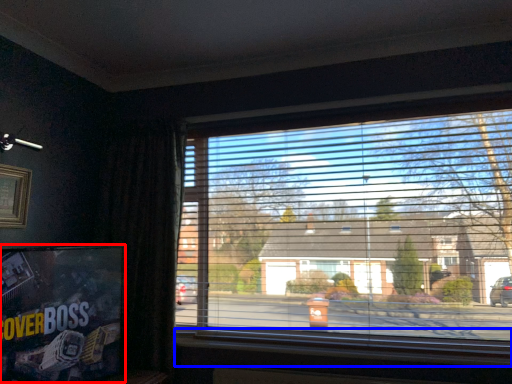
Question: Which point is further to the camera, tv show (highlighted by a red box) or window sill (highlighted by a blue box)?

Choices:
 (A) tv show
 (B) window sill

Answer: (B)